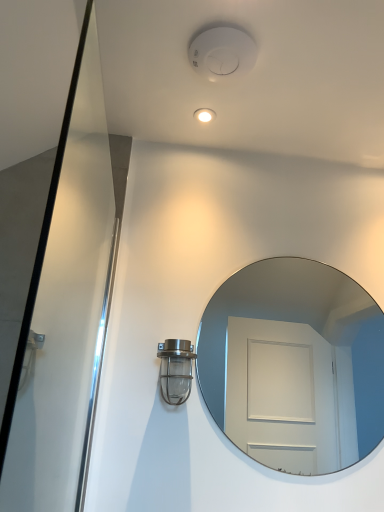
Question: Considering the positions of clear glass mirror at center and metallic glass light fixture at lower left in the image, is clear glass mirror at center wider or thinner than metallic glass light fixture at lower left?

Choices:
 (A) thin
 (B) wide

Answer: (A)

Question: From a real-world perspective, relative to metallic glass light fixture at lower left, is clear glass mirror at center vertically above or below?

Choices:
 (A) below
 (B) above

Answer: (B)

Question: Considering the positions of point (317, 274) and point (175, 384), is point (317, 274) closer or farther from the camera than point (175, 384)?

Choices:
 (A) farther
 (B) closer

Answer: (A)

Question: In terms of size, does metallic glass light fixture at lower left appear bigger or smaller than clear glass mirror at center?

Choices:
 (A) small
 (B) big

Answer: (A)

Question: In terms of width, does metallic glass light fixture at lower left look wider or thinner when compared to clear glass mirror at center?

Choices:
 (A) thin
 (B) wide

Answer: (B)

Question: From the image's perspective, is metallic glass light fixture at lower left located above or below clear glass mirror at center?

Choices:
 (A) below
 (B) above

Answer: (A)

Question: Is point pyautogui.click(x=173, y=373) positioned closer to the camera than point pyautogui.click(x=322, y=317)?

Choices:
 (A) closer
 (B) farther

Answer: (A)